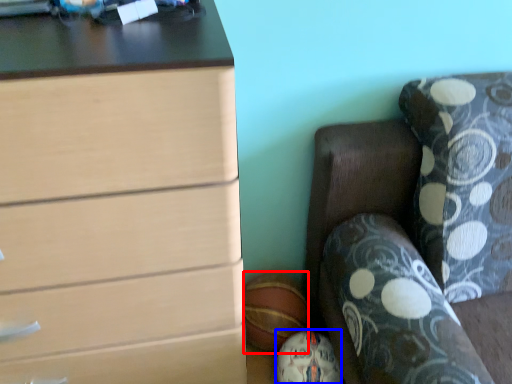
Question: Which point is further to the camera, sports equipment (highlighted by a red box) or sports equipment (highlighted by a blue box)?

Choices:
 (A) sports equipment
 (B) sports equipment

Answer: (A)